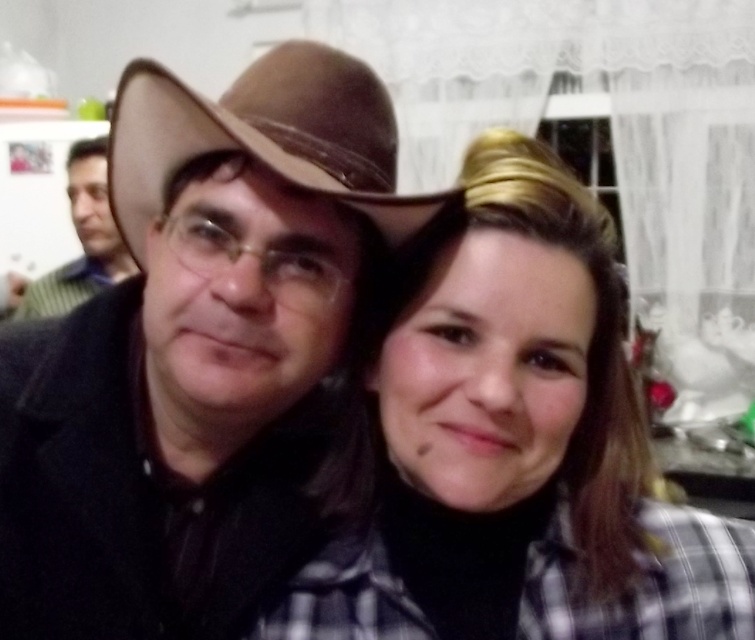
From the picture: Who is positioned more to the left, brown leather cowboy hat at upper left or matte black shirt at left?

matte black shirt at left

Identify the location of brown leather cowboy hat at upper left. Image resolution: width=755 pixels, height=640 pixels. (264, 138).

I want to click on brown leather cowboy hat at upper left, so click(264, 138).

Who is more forward, (331, 556) or (156, 163)?

Point (156, 163)

What do you see at coordinates (518, 449) in the screenshot?
I see `plaid fabric shirt at center` at bounding box center [518, 449].

Is point (393, 420) in front of point (176, 100)?

That is False.

You are a GUI agent. You are given a task and a screenshot of the screen. Output one action in this format:
    pyautogui.click(x=<x>, y=<y>)
    Task: Click on the plaid fabric shirt at center
    The height and width of the screenshot is (640, 755).
    Given the screenshot: What is the action you would take?
    pyautogui.click(x=518, y=449)

Image resolution: width=755 pixels, height=640 pixels. I want to click on plaid fabric shirt at center, so click(518, 449).

Which of these two, plaid fabric shirt at center or matte black shirt at left, stands shorter?

With less height is plaid fabric shirt at center.

Measure the distance between point [590,438] and camera.

Point [590,438] and camera are 25.41 inches apart.

The width and height of the screenshot is (755, 640). I want to click on plaid fabric shirt at center, so click(518, 449).